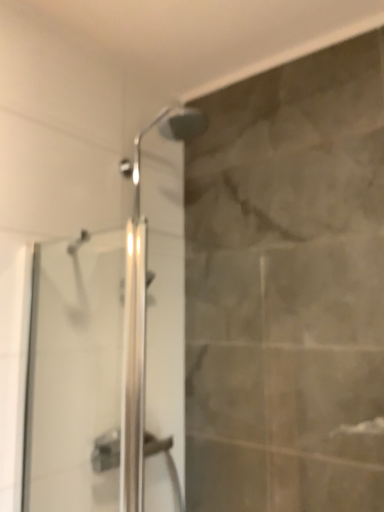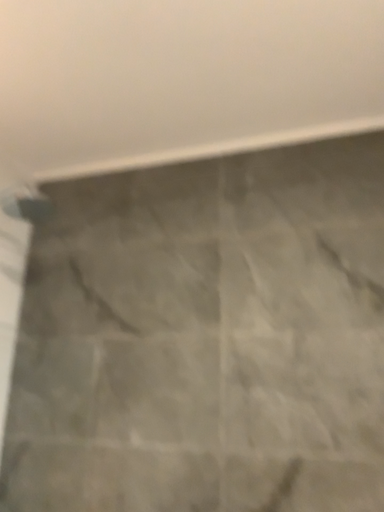
Question: Which way did the camera rotate in the video?

Choices:
 (A) rotated downward
 (B) rotated upward

Answer: (B)